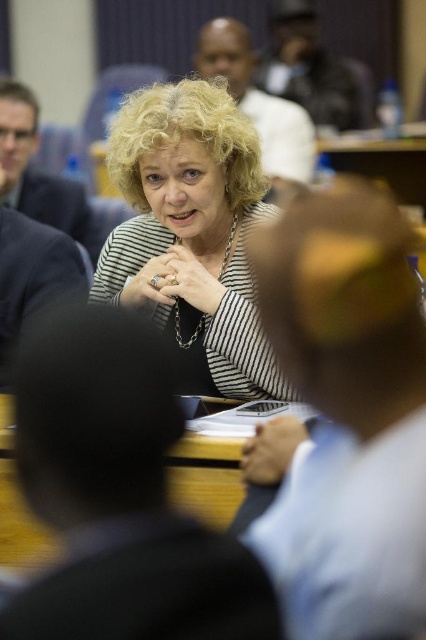
You are organizing a small event and need to place a 1.2 meter long banner on the wooden table at center. Considering the position of the striped fabric woman at center, will the banner fit on the table without overlapping her?

The wooden table at center is behind striped fabric woman at center, so placing a 1.2 meter long banner on the wooden table at center would not overlap her since the table is positioned behind her.

You are a photographer who wants to capture a closeup of the striped fabric woman at center and the wooden table at center. Which object is positioned higher in the image?

The striped fabric woman at center is positioned higher than the wooden table at center in the image.

You are a photographer who wants to zoom in on the striped fabric woman at center. What are the coordinates where you should focus?

The striped fabric woman at center is located at coordinates point (190, 227).